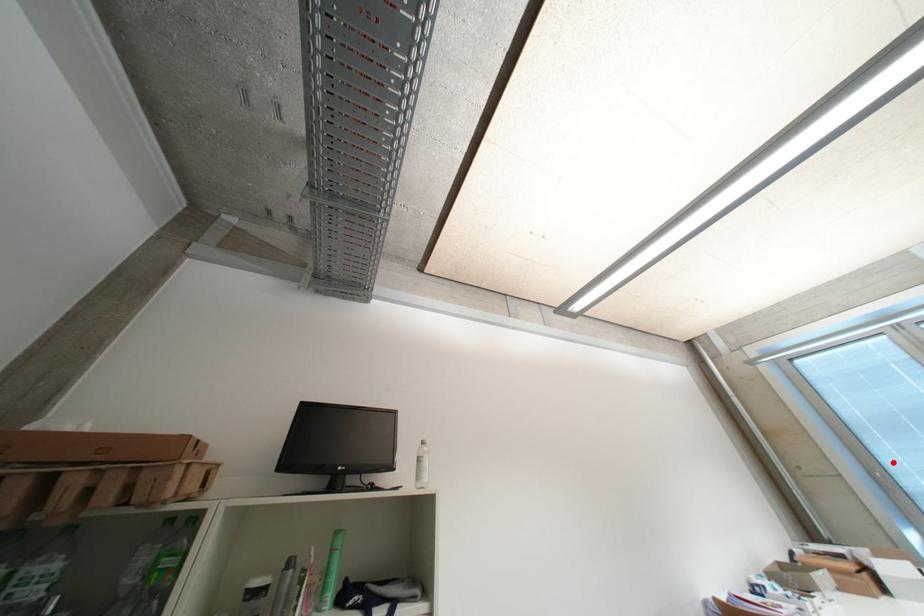
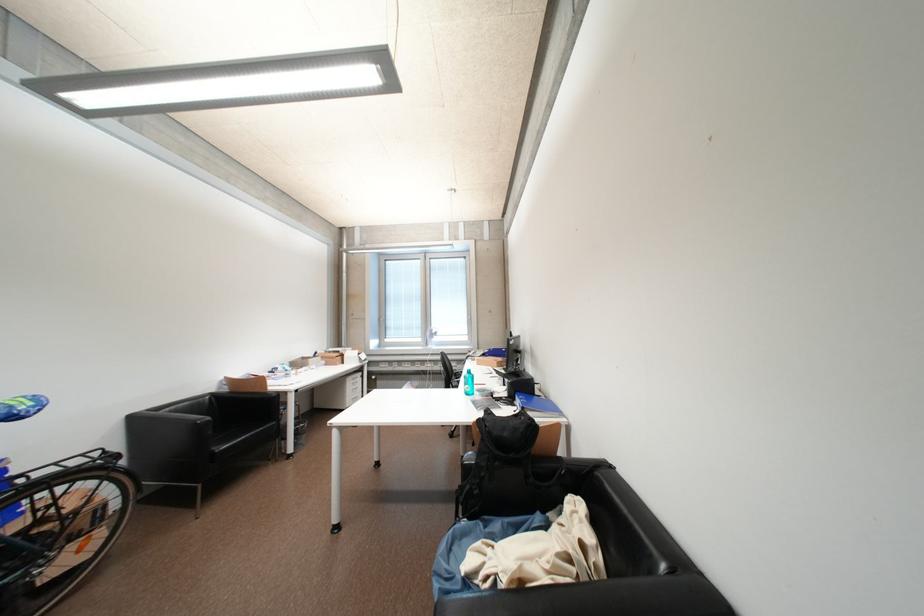
Question: A red point is marked in image1. In image2, is the corresponding 3D point closer to the camera or farther? Reply with the corresponding letter.

Choices:
 (A) The corresponding 3D point is closer.
 (B) The corresponding 3D point is farther.

Answer: (B)